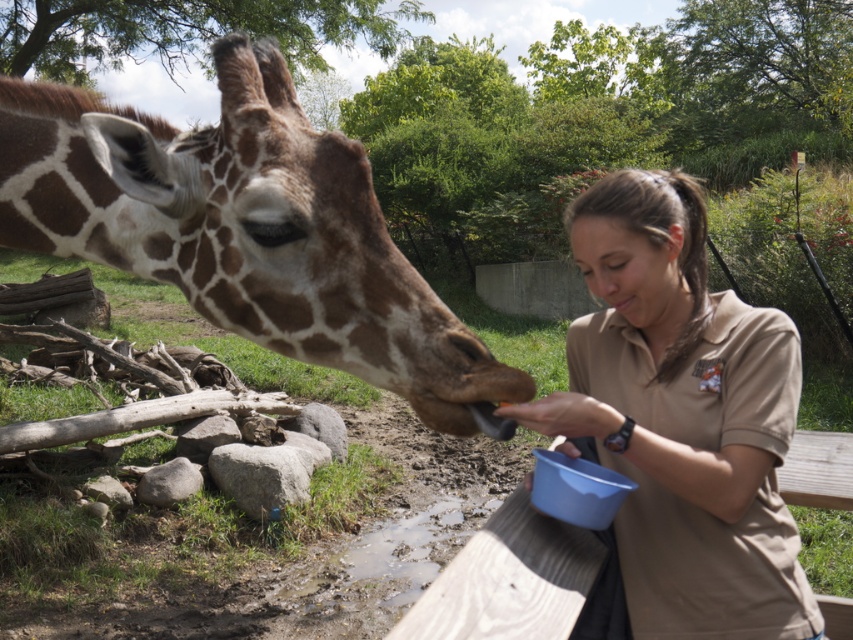
Question: Does brown spotted skin at center have a larger size compared to brown uniform at center?

Choices:
 (A) no
 (B) yes

Answer: (A)

Question: Is brown spotted skin at center to the left of brown uniform at center from the viewer's perspective?

Choices:
 (A) yes
 (B) no

Answer: (A)

Question: Is brown spotted skin at center wider than brown uniform at center?

Choices:
 (A) no
 (B) yes

Answer: (B)

Question: Which object is farther from the camera taking this photo?

Choices:
 (A) brown uniform at center
 (B) brown spotted skin at center

Answer: (A)

Question: Which object appears closest to the camera in this image?

Choices:
 (A) brown uniform at center
 (B) brown spotted skin at center

Answer: (B)